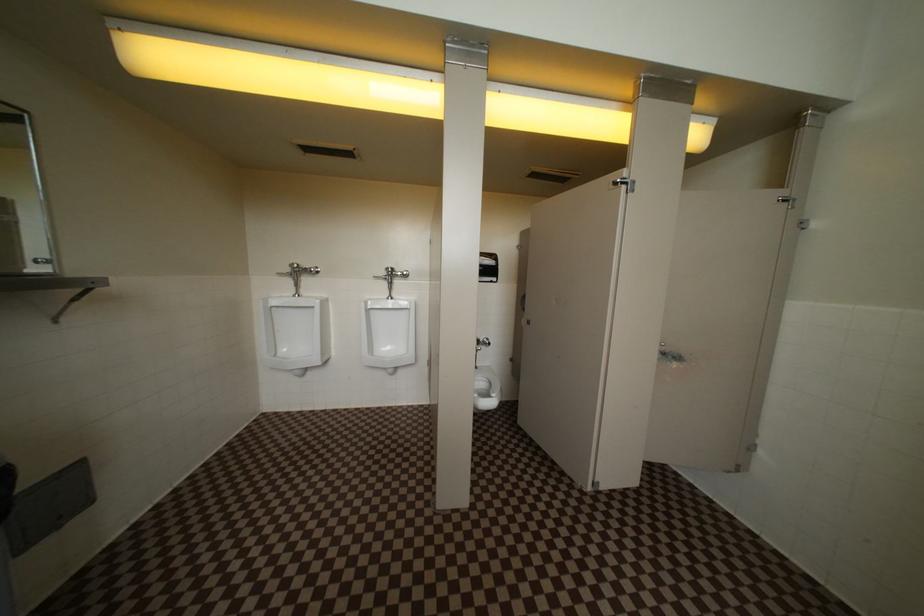
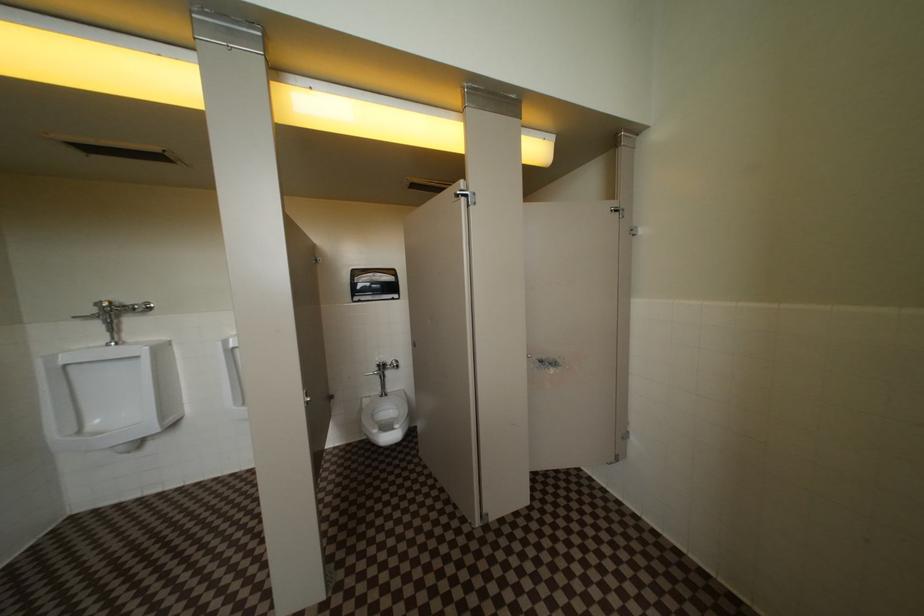
Question: What movement of the cameraman would produce the second image?

Choices:
 (A) Left
 (B) Right
 (C) Forward
 (D) Backward

Answer: (B)